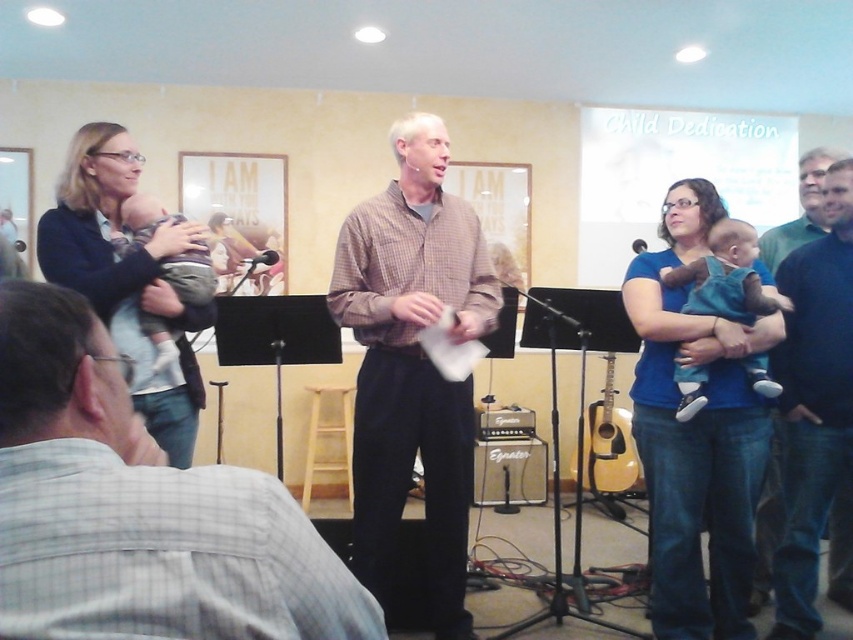
Question: Does light brown fabric baby at center have a greater width compared to acoustic guitar at center?

Choices:
 (A) yes
 (B) no

Answer: (B)

Question: Which object is farther from the camera taking this photo?

Choices:
 (A) brown checkered shirt at center
 (B) black matte amplifier at center
 (C) black smooth pants at center

Answer: (B)

Question: Which of the following is the farthest from the observer?

Choices:
 (A) black smooth pants at center
 (B) brown checkered shirt at center

Answer: (A)

Question: Is brown checkered shirt at center to the left of black plastic microphone at center from the viewer's perspective?

Choices:
 (A) no
 (B) yes

Answer: (A)

Question: Is light brown fabric baby at center thinner than black plastic microphone at center?

Choices:
 (A) no
 (B) yes

Answer: (A)

Question: Which object is the farthest from the plaid shirt at center?

Choices:
 (A) metallic silver microphone at center
 (B) light brown fabric baby at center
 (C) black smooth pants at center

Answer: (A)